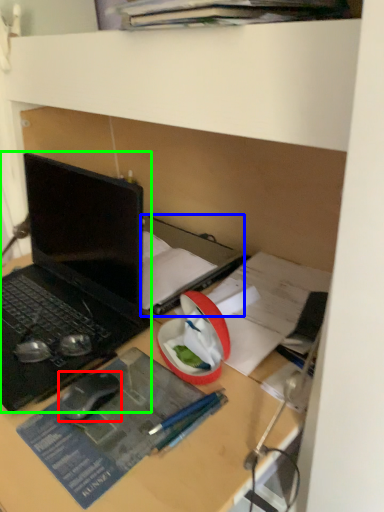
Question: Which object is the farthest from mouse (highlighted by a red box)? Choose among these: book (highlighted by a blue box) or laptop (highlighted by a green box).

Choices:
 (A) book
 (B) laptop

Answer: (A)